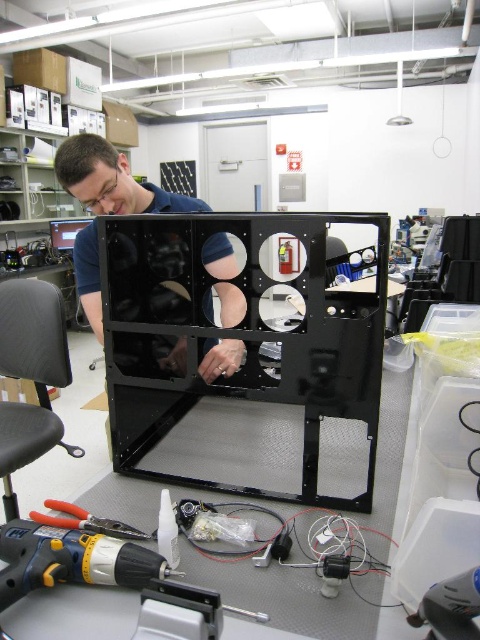
You are standing in the workspace and see two points marked in the image. According to their coordinates, which point is closer to you, point (94,321) or point (17,595)?

Point (17,595) is closer to you because in the coordinate system used here, lower y values indicate positions closer to the viewer. Since point (17,595) has a y value of 0.037, which is lower than 0.196, it is positioned closer.

You are an engineer working in a lab. You need to choose a tool from the workspace to perform a task that requires a tool no wider than 10 cm. You see the yellow plastic drill at lower left and the yellow plastic pliers at lower left. Which tool should you choose?

The yellow plastic pliers at lower left should be chosen because the yellow plastic drill at lower left might be wider than 10 cm, while the pliers are likely narrower.

You are a technician working on the large black rectangular frame structure. You need to place a sensor at the point closer to the camera between point (236, 292) and point (121, 531). Which point should you choose?

You should choose point (121, 531) because it is closer to the camera than point (236, 292).